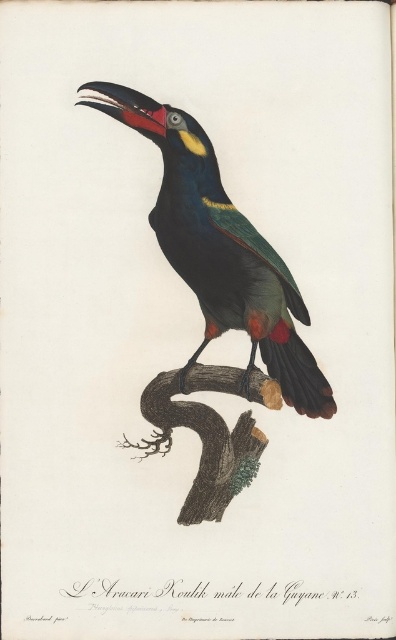
Which is above, shiny black toucan at center or brown textured branch at center?

shiny black toucan at center

Does point (119, 108) come closer to viewer compared to point (211, 417)?

Yes, point (119, 108) is closer to viewer.

What do you see at coordinates (220, 250) in the screenshot? I see `shiny black toucan at center` at bounding box center [220, 250].

This screenshot has height=640, width=396. I want to click on shiny black toucan at center, so click(x=220, y=250).